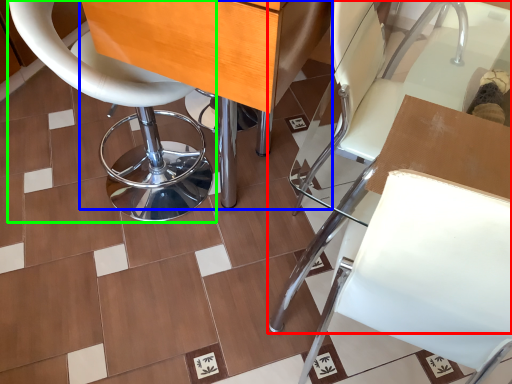
Question: Based on their relative distances, which object is nearer to chair (highlighted by a red box)? Choose from table (highlighted by a blue box) and chair (highlighted by a green box).

Choices:
 (A) table
 (B) chair

Answer: (A)